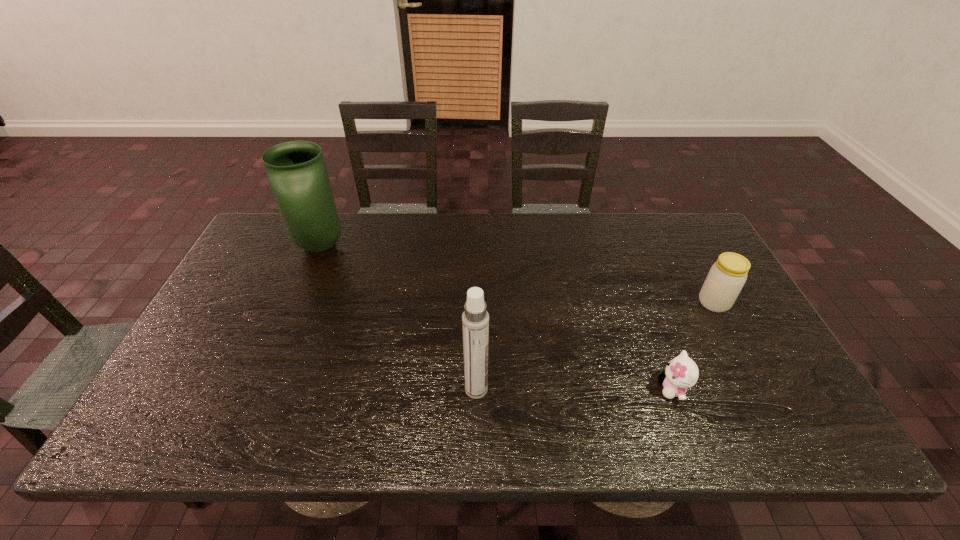
The image size is (960, 540). In order to click on unoccupied position between the second object from right to left and the vase in this screenshot , I will do coord(496,317).

Identify which object is the closest to the kitten. Please provide its 2D coordinates. Your answer should be formatted as a tuple, i.e. [(x, y)], where the tuple contains the x and y coordinates of a point satisfying the conditions above.

[(727, 276)]

Locate which object is the closest to the second object from left to right. Please provide its 2D coordinates. Your answer should be formatted as a tuple, i.e. [(x, y)], where the tuple contains the x and y coordinates of a point satisfying the conditions above.

[(681, 373)]

The image size is (960, 540). I want to click on free location that satisfies the following two spatial constraints: 1. on the front side of the third tallest object; 2. on the right side of the farthest object, so click(x=296, y=302).

Where is `vacant space that satisfies the following two spatial constraints: 1. on the front-facing side of the shortest object; 2. on the front side of the aerosol can`? This screenshot has width=960, height=540. vacant space that satisfies the following two spatial constraints: 1. on the front-facing side of the shortest object; 2. on the front side of the aerosol can is located at coordinates (673, 389).